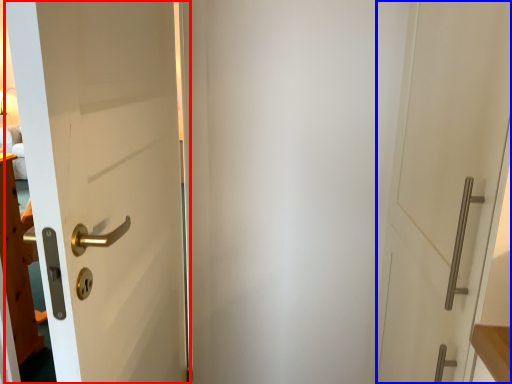
Question: Which object appears closest to the camera in this image, door (highlighted by a red box) or door (highlighted by a blue box)?

Choices:
 (A) door
 (B) door

Answer: (B)